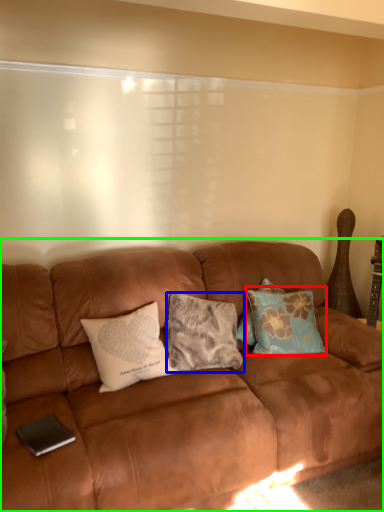
Question: Based on their relative distances, which object is nearer to pillow (highlighted by a red box)? Choose from pillow (highlighted by a blue box) and studio couch (highlighted by a green box).

Choices:
 (A) pillow
 (B) studio couch

Answer: (A)